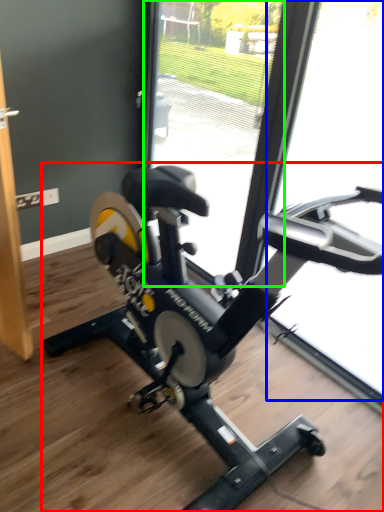
Question: Which object is the farthest from stationary bicycle (highlighted by a red box)? Choose among these: glass door (highlighted by a blue box) or glass door (highlighted by a green box).

Choices:
 (A) glass door
 (B) glass door

Answer: (B)